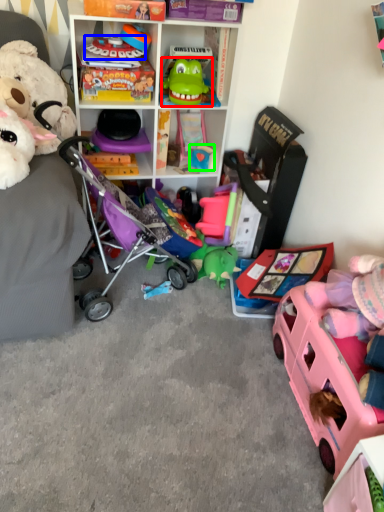
Question: Which object is the farthest from toy (highlighted by a red box)? Choose among these: toy (highlighted by a blue box) or toy (highlighted by a green box).

Choices:
 (A) toy
 (B) toy

Answer: (B)